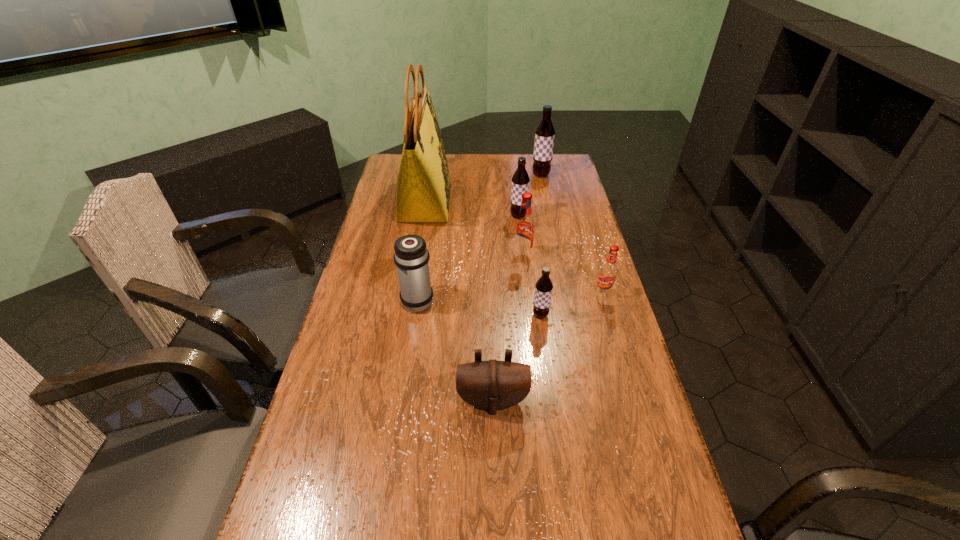
Identify the location of the tallest object. The image size is (960, 540). (423, 186).

Identify the location of tote bag. This screenshot has width=960, height=540. 423,186.

Identify the location of the second root beer from right to left. (545, 132).

The image size is (960, 540). In order to click on the biggest brown root beer in this screenshot , I will do `click(545, 132)`.

Where is `the third farthest root beer`? Image resolution: width=960 pixels, height=540 pixels. the third farthest root beer is located at coordinates (524, 227).

Locate an element on the screen. This screenshot has height=540, width=960. the bigger red root beer is located at coordinates (524, 227).

Where is `the second farthest brown root beer`? the second farthest brown root beer is located at coordinates (520, 180).

At what (x,y) coordinates should I click in order to perform the action: click on the second farthest root beer. Please return your answer as a coordinate pair (x, y). Image resolution: width=960 pixels, height=540 pixels. Looking at the image, I should click on (520, 180).

Identify the location of thermos bottle. The width and height of the screenshot is (960, 540). (411, 256).

In order to click on the rightmost object in this screenshot , I will do `click(608, 272)`.